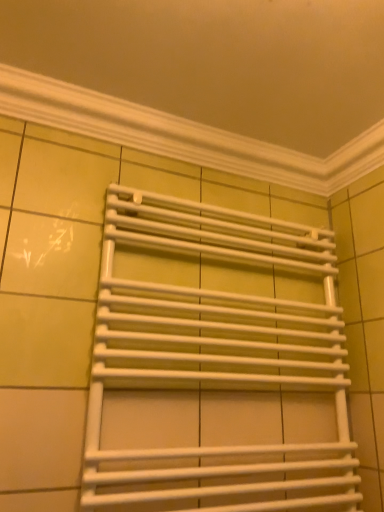
Question: Can you confirm if white matte towel rack at center is taller than white plastic towel rack at upper center?

Choices:
 (A) no
 (B) yes

Answer: (B)

Question: Does white matte towel rack at center turn towards white plastic towel rack at upper center?

Choices:
 (A) yes
 (B) no

Answer: (B)

Question: From the image's perspective, is white matte towel rack at center located beneath white plastic towel rack at upper center?

Choices:
 (A) yes
 (B) no

Answer: (A)

Question: From the image's perspective, is white matte towel rack at center over white plastic towel rack at upper center?

Choices:
 (A) no
 (B) yes

Answer: (A)

Question: Does white matte towel rack at center have a smaller size compared to white plastic towel rack at upper center?

Choices:
 (A) no
 (B) yes

Answer: (A)

Question: Is white matte towel rack at center not near white plastic towel rack at upper center?

Choices:
 (A) yes
 (B) no

Answer: (B)

Question: Is white plastic towel rack at upper center positioned behind white matte towel rack at center?

Choices:
 (A) no
 (B) yes

Answer: (B)

Question: Can you confirm if white plastic towel rack at upper center is thinner than white matte towel rack at center?

Choices:
 (A) no
 (B) yes

Answer: (B)

Question: Considering the relative positions of white plastic towel rack at upper center and white matte towel rack at center in the image provided, is white plastic towel rack at upper center to the right of white matte towel rack at center from the viewer's perspective?

Choices:
 (A) yes
 (B) no

Answer: (B)

Question: Can you confirm if white plastic towel rack at upper center is wider than white matte towel rack at center?

Choices:
 (A) no
 (B) yes

Answer: (A)

Question: Is white plastic towel rack at upper center aimed at white matte towel rack at center?

Choices:
 (A) no
 (B) yes

Answer: (A)

Question: Does white plastic towel rack at upper center contain white matte towel rack at center?

Choices:
 (A) no
 (B) yes

Answer: (A)

Question: In the image, is white matte towel rack at center on the left side or the right side of white plastic towel rack at upper center?

Choices:
 (A) right
 (B) left

Answer: (A)